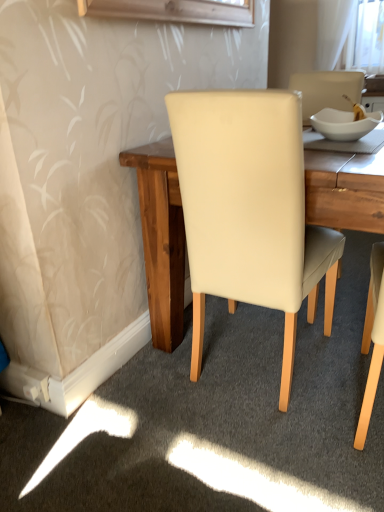
Question: Considering the relative positions of cream leather chair at center and white glossy bowl at upper right in the image provided, is cream leather chair at center in front of white glossy bowl at upper right?

Choices:
 (A) no
 (B) yes

Answer: (B)

Question: Is cream leather chair at center bigger than white glossy bowl at upper right?

Choices:
 (A) yes
 (B) no

Answer: (A)

Question: From a real-world perspective, is cream leather chair at center on top of white glossy bowl at upper right?

Choices:
 (A) no
 (B) yes

Answer: (A)

Question: Considering the relative sizes of cream leather chair at center and white glossy bowl at upper right in the image provided, is cream leather chair at center wider than white glossy bowl at upper right?

Choices:
 (A) no
 (B) yes

Answer: (B)

Question: From the image's perspective, is cream leather chair at center below white glossy bowl at upper right?

Choices:
 (A) no
 (B) yes

Answer: (B)

Question: Could you tell me if cream leather chair at center is turned towards white glossy bowl at upper right?

Choices:
 (A) yes
 (B) no

Answer: (A)

Question: Is white glossy bowl at upper right to the right of cream leather chair at center from the viewer's perspective?

Choices:
 (A) no
 (B) yes

Answer: (B)

Question: From a real-world perspective, does white glossy bowl at upper right stand above cream leather chair at center?

Choices:
 (A) no
 (B) yes

Answer: (B)

Question: Is white glossy bowl at upper right facing away from cream leather chair at center?

Choices:
 (A) yes
 (B) no

Answer: (A)

Question: From the image's perspective, does white glossy bowl at upper right appear lower than cream leather chair at center?

Choices:
 (A) no
 (B) yes

Answer: (A)

Question: Is the position of white glossy bowl at upper right more distant than that of cream leather chair at center?

Choices:
 (A) no
 (B) yes

Answer: (B)

Question: Can you confirm if white glossy bowl at upper right is taller than cream leather chair at center?

Choices:
 (A) no
 (B) yes

Answer: (A)

Question: From the image's perspective, relative to cream leather chair at center, is white glossy bowl at upper right above or below?

Choices:
 (A) above
 (B) below

Answer: (A)